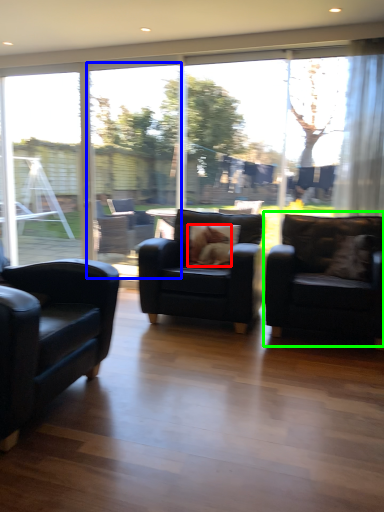
Question: Which is nearer to the animal (highlighted by a red box)? screen door (highlighted by a blue box) or chair (highlighted by a green box).

Choices:
 (A) screen door
 (B) chair

Answer: (B)